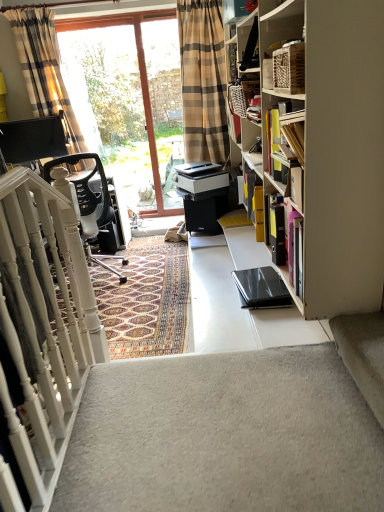
Question: Is plaid fabric curtain at upper left further to camera compared to black mesh office chair at left?

Choices:
 (A) yes
 (B) no

Answer: (A)

Question: Considering the relative sizes of plaid fabric curtain at upper left and black mesh office chair at left in the image provided, is plaid fabric curtain at upper left taller than black mesh office chair at left?

Choices:
 (A) yes
 (B) no

Answer: (A)

Question: Considering the relative sizes of plaid fabric curtain at upper left and black mesh office chair at left in the image provided, is plaid fabric curtain at upper left shorter than black mesh office chair at left?

Choices:
 (A) yes
 (B) no

Answer: (B)

Question: From the image's perspective, is plaid fabric curtain at upper left located above black mesh office chair at left?

Choices:
 (A) yes
 (B) no

Answer: (A)

Question: Does plaid fabric curtain at upper left have a smaller size compared to black mesh office chair at left?

Choices:
 (A) yes
 (B) no

Answer: (A)

Question: Considering the relative positions of plaid fabric curtain at upper left and black mesh office chair at left in the image provided, is plaid fabric curtain at upper left to the right of black mesh office chair at left from the viewer's perspective?

Choices:
 (A) no
 (B) yes

Answer: (A)

Question: From a real-world perspective, is black glossy phone at right on top of white carpet at lower left?

Choices:
 (A) no
 (B) yes

Answer: (B)

Question: Does black glossy phone at right appear on the left side of white carpet at lower left?

Choices:
 (A) no
 (B) yes

Answer: (A)

Question: Is black glossy phone at right wider than white carpet at lower left?

Choices:
 (A) no
 (B) yes

Answer: (A)

Question: Is black glossy phone at right positioned in front of white carpet at lower left?

Choices:
 (A) yes
 (B) no

Answer: (B)

Question: Can you confirm if black glossy phone at right is positioned to the right of white carpet at lower left?

Choices:
 (A) no
 (B) yes

Answer: (B)

Question: Is black glossy phone at right smaller than white carpet at lower left?

Choices:
 (A) yes
 (B) no

Answer: (A)

Question: Is the position of transparent glass screen door at upper left less distant than that of transparent glass window at upper center?

Choices:
 (A) yes
 (B) no

Answer: (A)